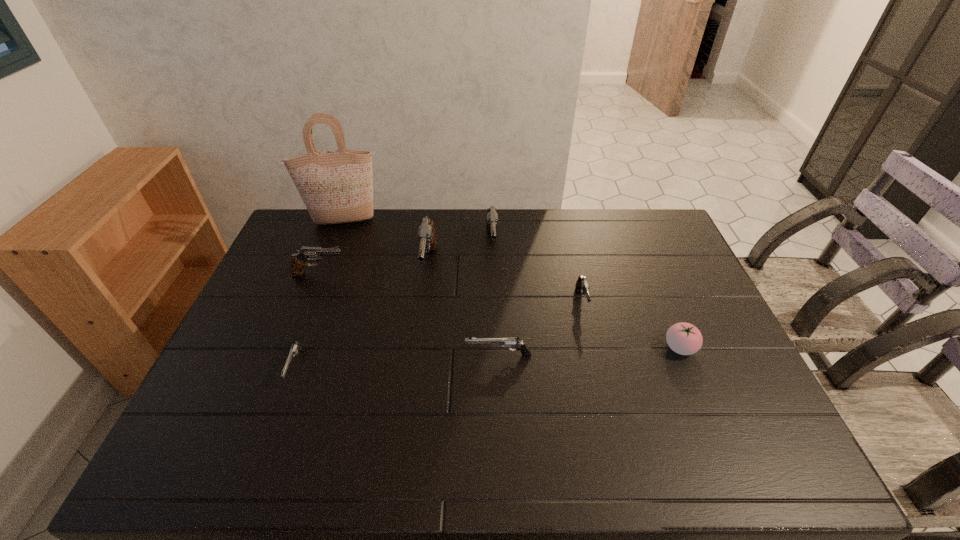
This screenshot has width=960, height=540. I want to click on free space located 0.390m on the back of the red tomato, so click(638, 248).

Identify the location of free region located 0.360m on the front-facing side of the second shortest pistol. The image size is (960, 540). click(333, 355).

You are a GUI agent. You are given a task and a screenshot of the screen. Output one action in this format:
    pyautogui.click(x=<x>, y=<y>)
    Task: Click on the free space located 0.180m on the front-facing side of the second shortest pistol
    The height and width of the screenshot is (540, 960).
    Given the screenshot: What is the action you would take?
    click(x=399, y=355)

Find the location of a particular element. The image size is (960, 540). blank space located 0.100m on the front-facing side of the second shortest pistol is located at coordinates (428, 355).

Find the location of a particular element. This screenshot has height=540, width=960. free location located 0.150m on the front-facing side of the left silver pistol is located at coordinates (267, 444).

Where is `shopping bag present at the far edge`? shopping bag present at the far edge is located at coordinates (336, 187).

Where is `shopping bag that is at the left edge`? shopping bag that is at the left edge is located at coordinates (336, 187).

This screenshot has width=960, height=540. In order to click on pistol that is at the left edge in this screenshot , I will do 299,260.

The image size is (960, 540). Find the location of `object present at the right edge`. object present at the right edge is located at coordinates (683, 338).

The image size is (960, 540). Identify the location of object present at the far left corner. (336, 187).